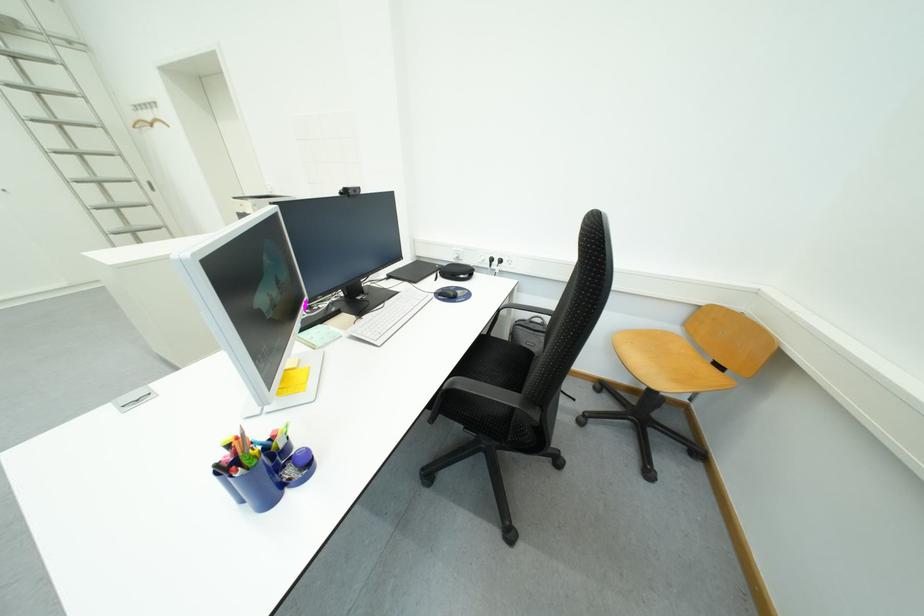
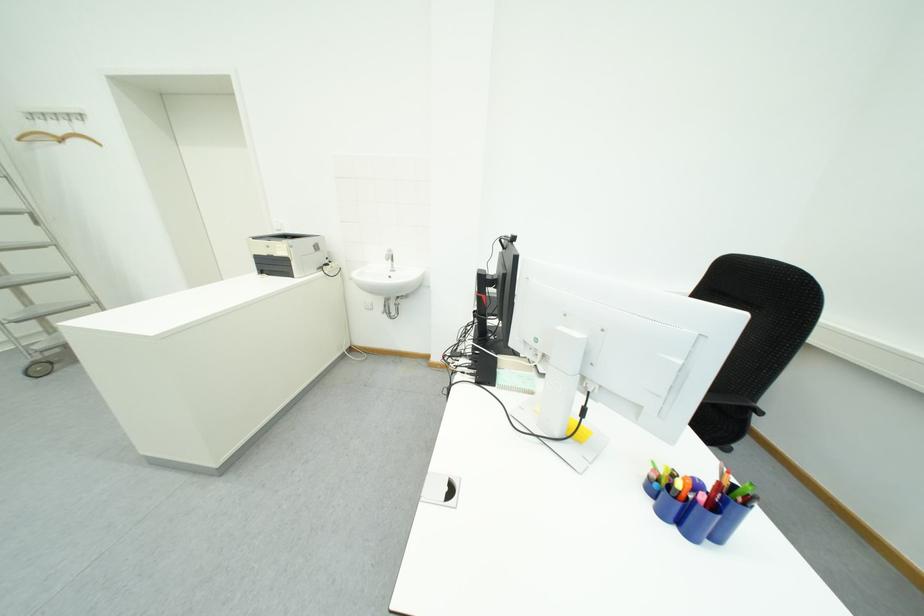
Where in the second image is the point corresponding to (161,122) from the first image?

(69, 136)